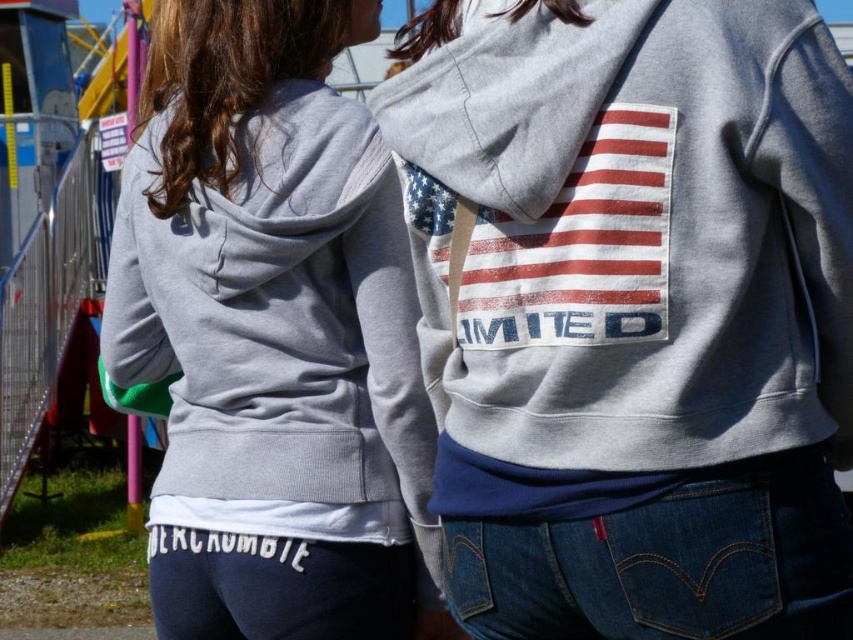
You are standing in the fairground and see two people wearing gray hoodies. There is a specific point marked at coordinates (630, 230). What is located at that point?

The gray heathered hoodie at center is located at point (630, 230).

You are a photographer trying to capture a candid shot of both the matte gray hoodie at center and the distressed white flag at center. Given that your camera has a maximum focus range of 30 inches, will you be able to focus on both subjects simultaneously?

The distance between the matte gray hoodie at center and the distressed white flag at center is 29.81 inches, which is within the camera maximum focus range of 30 inches. Therefore, the camera can focus on both subjects simultaneously.

You are standing at the origin point in the image. There are two points marked in the image, point [469,388] and point [514,257]. Which point is farther away from you?

Point [469,388] is behind point [514,257], so it is farther away from you.